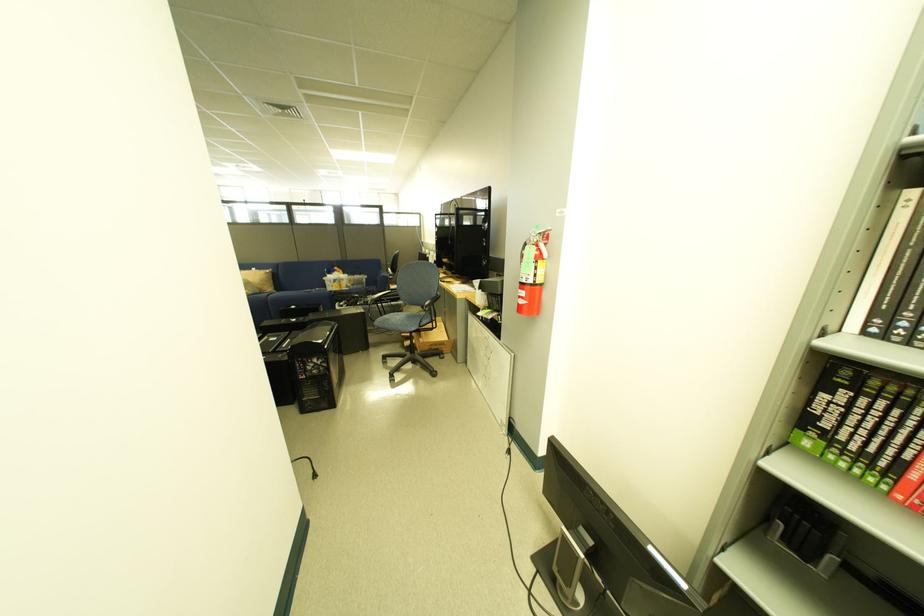
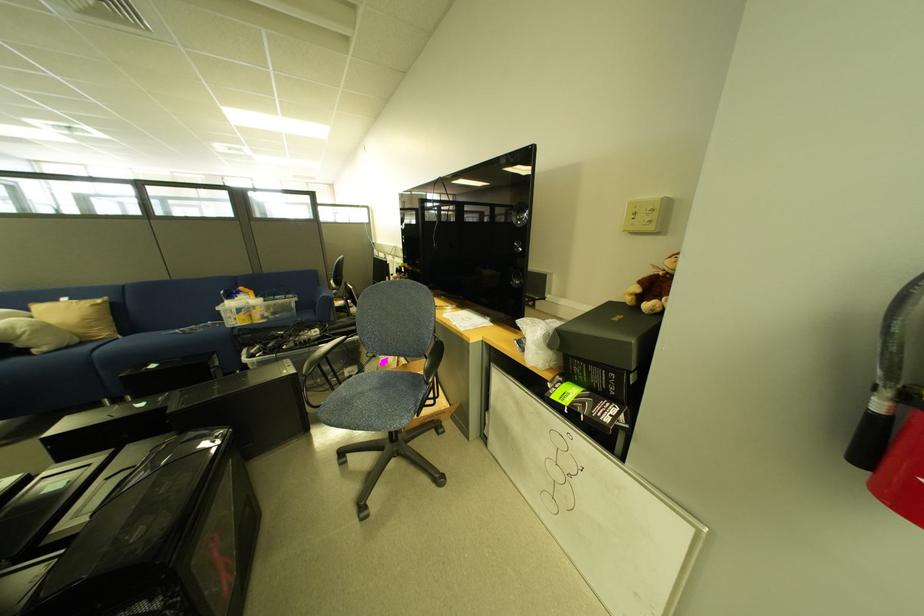
Where in the second image is the point corresponding to point (396, 315) from the first image?

(350, 386)